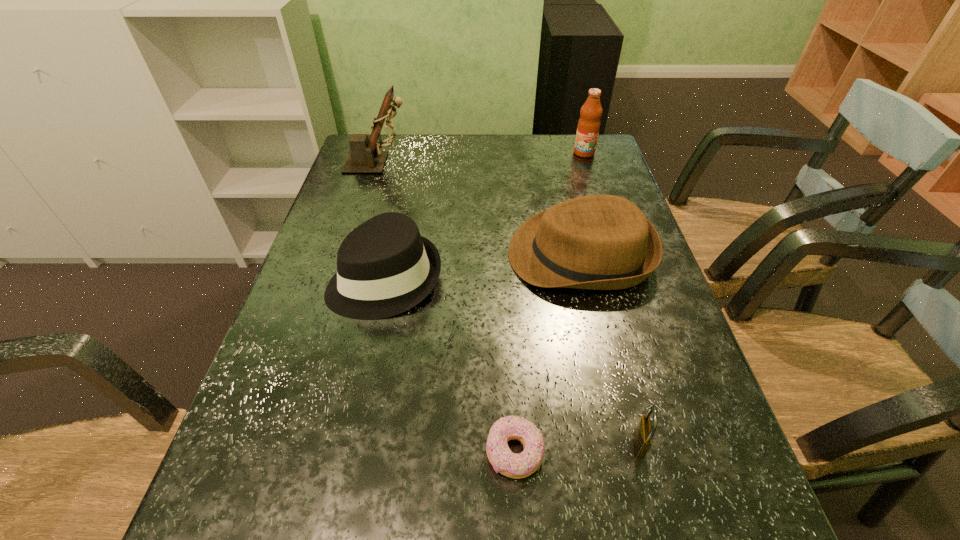
Locate an element on the screen. free space between the figurine and the fifth shortest object is located at coordinates (481, 158).

The image size is (960, 540). In order to click on blank region between the second shortest object and the right fedora in this screenshot , I will do `click(610, 349)`.

The height and width of the screenshot is (540, 960). What are the coordinates of `unoccupied position between the tallest object and the right fedora` in the screenshot? It's located at (479, 209).

Find the location of a particular element. empty location between the shortest object and the tallest object is located at coordinates click(446, 308).

Identify the location of vacant area between the left fedora and the right fedora. This screenshot has width=960, height=540. (483, 267).

Locate an element on the screen. Image resolution: width=960 pixels, height=540 pixels. free point between the figurine and the doughnut is located at coordinates (446, 308).

Point out which object is positioned as the nearest to the fifth shortest object. Please provide its 2D coordinates. Your answer should be formatted as a tuple, i.e. [(x, y)], where the tuple contains the x and y coordinates of a point satisfying the conditions above.

[(600, 242)]

I want to click on object that stands as the fifth closest to the second tallest object, so click(x=512, y=465).

The height and width of the screenshot is (540, 960). Identify the location of vacant space that satisfies the following two spatial constraints: 1. on the front-facing side of the fifth tallest object; 2. on the right side of the right fedora. (625, 443).

The image size is (960, 540). Find the location of `free space in the image that satisfies the following two spatial constraints: 1. on the front-facing side of the second shortest object; 2. on the right side of the tallest object`. free space in the image that satisfies the following two spatial constraints: 1. on the front-facing side of the second shortest object; 2. on the right side of the tallest object is located at coordinates (291, 443).